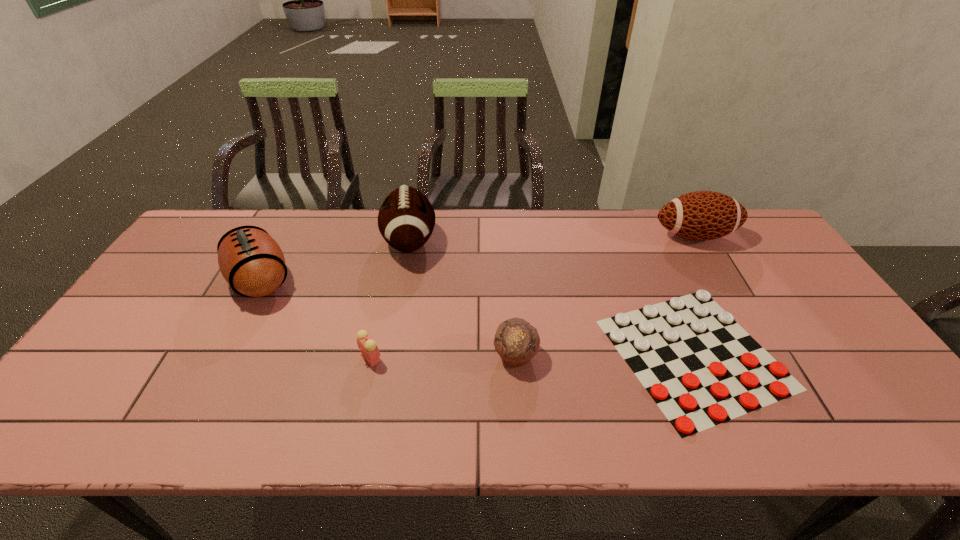
Where is `free spot at the near right corner of the desktop`? The image size is (960, 540). free spot at the near right corner of the desktop is located at coordinates (901, 412).

I want to click on vacant area between the rightmost football (American) and the second football (American) from left to right, so click(x=552, y=238).

Where is `free space between the third shortest object and the checkerboard`? free space between the third shortest object and the checkerboard is located at coordinates (605, 354).

This screenshot has height=540, width=960. Find the location of `free space between the muffin and the rightmost football (American)`. free space between the muffin and the rightmost football (American) is located at coordinates (605, 295).

You are a GUI agent. You are given a task and a screenshot of the screen. Output one action in this format:
    pyautogui.click(x=<x>, y=<y>)
    Task: Click on the vacant space that's between the second football (American) from right to left and the second shortest object
    The width and height of the screenshot is (960, 540).
    Given the screenshot: What is the action you would take?
    pyautogui.click(x=391, y=300)

Locate an element on the screen. free space between the alarm clock and the second football (American) from right to left is located at coordinates (391, 300).

What are the coordinates of `empty space between the third object from right to left and the alarm clock` in the screenshot? It's located at (444, 356).

Where is `free space between the second football (American) from right to left and the muffin`? Image resolution: width=960 pixels, height=540 pixels. free space between the second football (American) from right to left and the muffin is located at coordinates (463, 299).

At what (x,y) coordinates should I click in order to perform the action: click on free space between the third object from right to left and the rightmost football (American). Please return your answer as a coordinate pair (x, y). This screenshot has width=960, height=540. Looking at the image, I should click on (605, 295).

Where is `free space between the rightmost football (American) and the second football (American) from right to left`? The width and height of the screenshot is (960, 540). free space between the rightmost football (American) and the second football (American) from right to left is located at coordinates (552, 238).